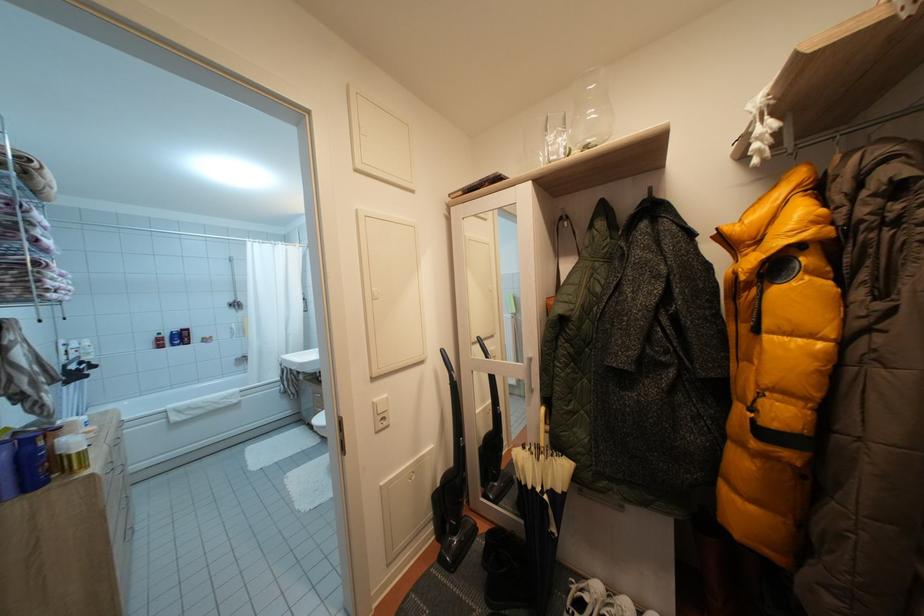
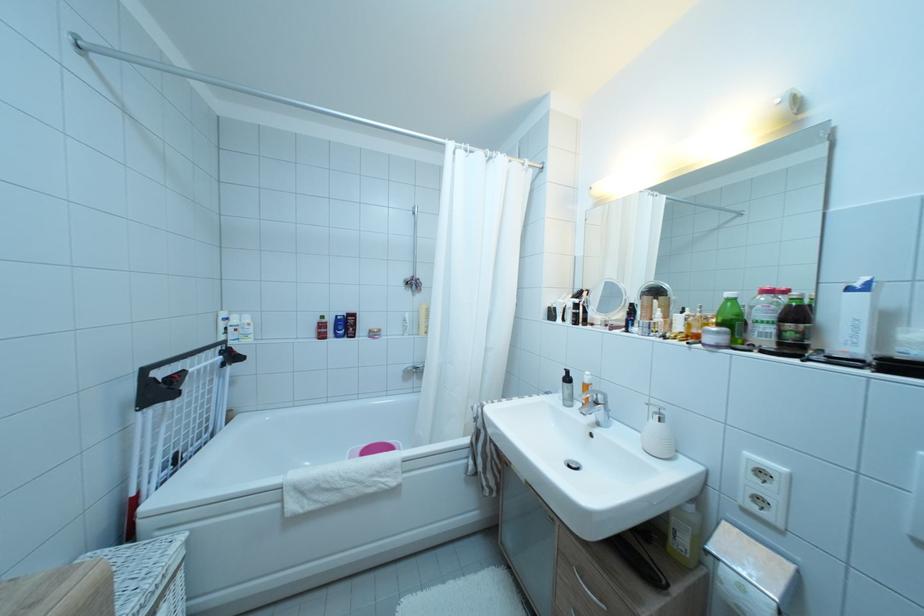
Question: I am providing you with two images of the same scene from different viewpoints. After the viewpoint changes to image2, which objects are now occluded?

Choices:
 (A) red shampoo bottle
 (B) orange bottle pump
 (C) tub faucet handle
 (D) none of these

Answer: (D)